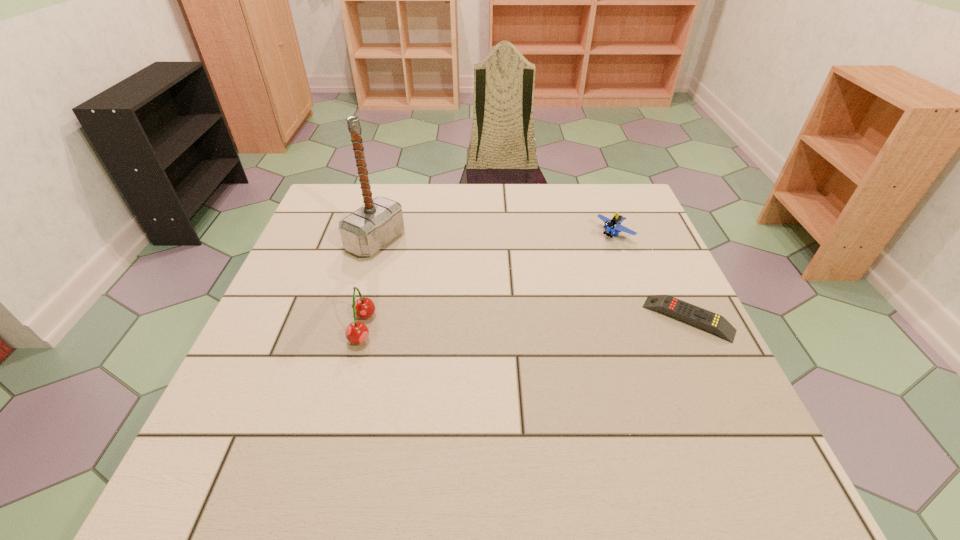
Locate an element on the screen. The width and height of the screenshot is (960, 540). vacant space on the desktop that is between the second tallest object and the shortest object and is positioned on the striking surface of the hammer is located at coordinates (564, 322).

Where is `free space on the desktop that is between the third shortest object and the shortest object and is positioned on the front-facing side of the Lego`? The image size is (960, 540). free space on the desktop that is between the third shortest object and the shortest object and is positioned on the front-facing side of the Lego is located at coordinates (481, 325).